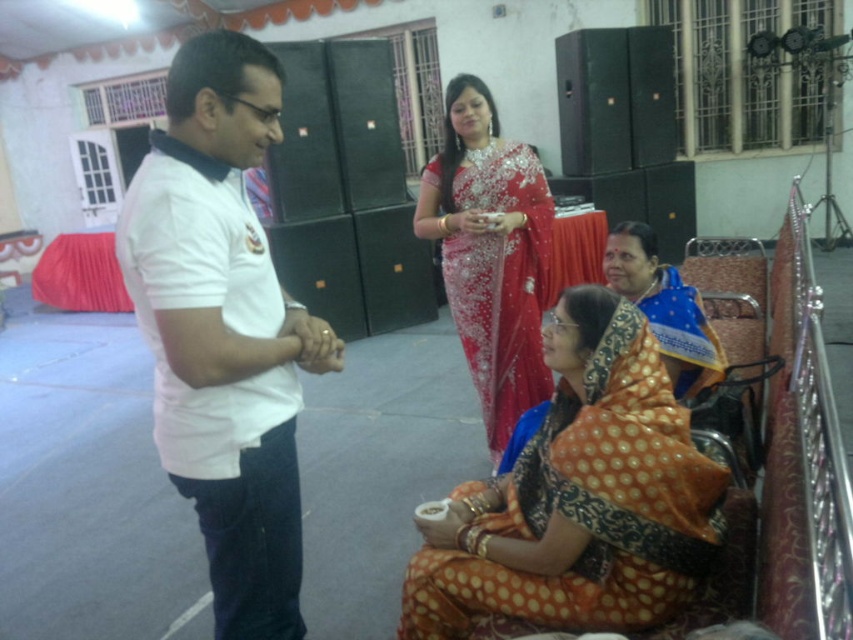
Question: Is white cotton shirt at left to the left of orange dotted saree at lower right from the viewer's perspective?

Choices:
 (A) no
 (B) yes

Answer: (B)

Question: Which object is farther from the camera taking this photo?

Choices:
 (A) white cotton shirt at left
 (B) orange printed saree at center

Answer: (B)

Question: Is white cotton shirt at left closer to camera compared to orange dotted saree at lower right?

Choices:
 (A) yes
 (B) no

Answer: (A)

Question: Which object is farther from the camera taking this photo?

Choices:
 (A) orange printed saree at center
 (B) shiny red saree at center
 (C) white cotton shirt at left
 (D) orange dotted saree at lower right

Answer: (B)

Question: From the image, what is the correct spatial relationship of orange printed saree at center in relation to shiny red saree at center?

Choices:
 (A) above
 (B) below

Answer: (B)

Question: Which of the following is the closest to the observer?

Choices:
 (A) (407, 584)
 (B) (659, 296)

Answer: (A)